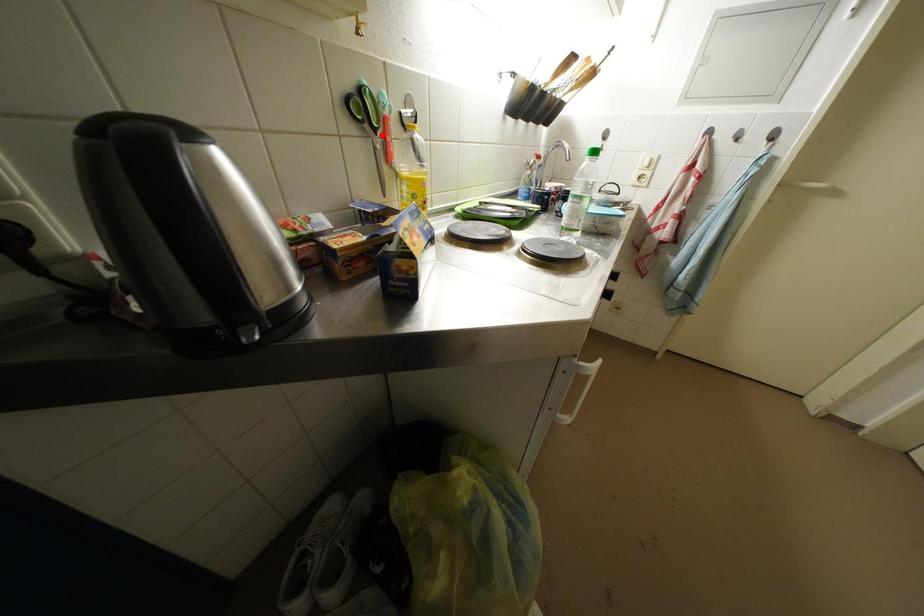
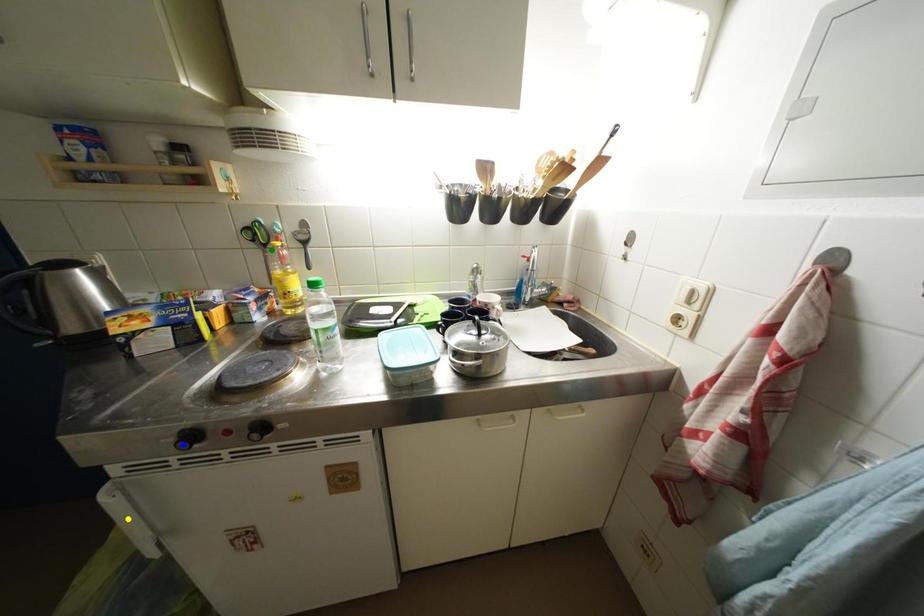
Question: I am providing you with two images of the same scene from different viewpoints. A red point is marked on the first image. You are given multiple points on the second image. Which mark in image 2 goes with the point in image 1?

Choices:
 (A) green point
 (B) yellow point
 (C) blue point

Answer: (A)